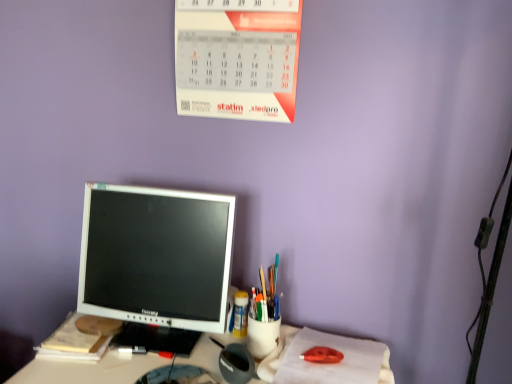
Question: From a real-world perspective, is yellow paper notebook at lower left physically located above or below red paper calendar at upper center?

Choices:
 (A) above
 (B) below

Answer: (B)

Question: Considering their positions, is yellow paper notebook at lower left located in front of or behind red paper calendar at upper center?

Choices:
 (A) front
 (B) behind

Answer: (B)

Question: Estimate the real-world distances between objects in this image. Which object is farther from the white glossy monitor at center?

Choices:
 (A) matte plastic cup at center, placed as the 1th stationery when sorted from right to left
 (B) translucent plastic cup at center, which ranks as the 2th stationery in front-to-back order
 (C) red paper calendar at upper center
 (D) yellow paper notebook at lower left
 (E) white glossy computer monitor at center

Answer: (C)

Question: Estimate the real-world distances between objects in this image. Which object is closer to the matte plastic cup at center, placed as the 1th stationery when sorted from right to left?

Choices:
 (A) red paper calendar at upper center
 (B) white glossy computer monitor at center
 (C) translucent plastic cup at center, arranged as the 2th stationery when viewed from the right
 (D) white glossy monitor at center
 (E) yellow paper notebook at lower left

Answer: (C)